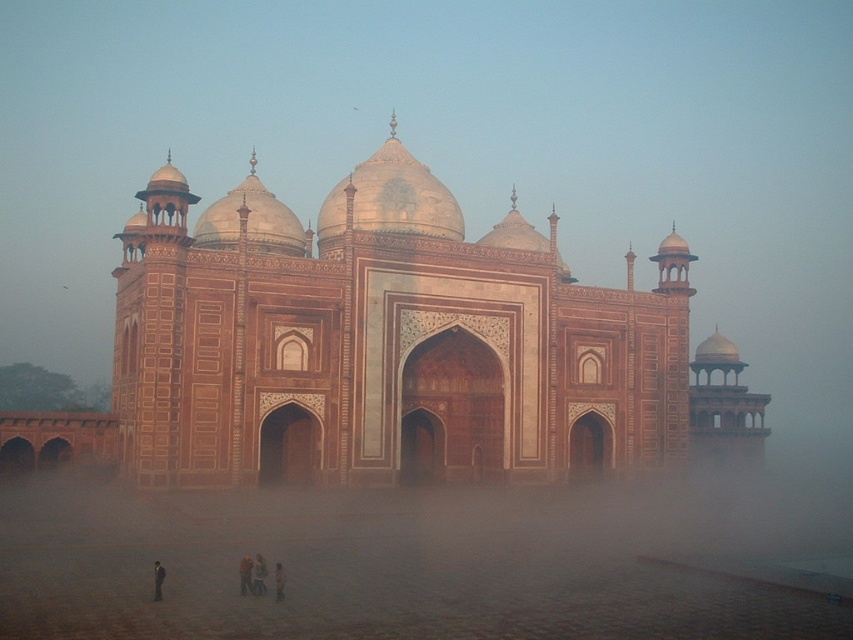
Question: Is marble palace at center further to camera compared to light brown fabric pants at lower center?

Choices:
 (A) no
 (B) yes

Answer: (B)

Question: Which object is positioned farthest from the light brown fabric pants at lower center?

Choices:
 (A) dark blue fabric at lower center
 (B) marble palace at center
 (C) light brown leather jacket at lower center

Answer: (B)

Question: Is marble palace at center wider than light brown leather jacket at lower center?

Choices:
 (A) no
 (B) yes

Answer: (B)

Question: Which object is farther from the camera taking this photo?

Choices:
 (A) light brown fabric pants at lower center
 (B) marble palace at center

Answer: (B)

Question: Which object is the farthest from the marble palace at center?

Choices:
 (A) light brown fabric pants at lower center
 (B) light brown leather jacket at lower center
 (C) dark blue fabric at lower center

Answer: (C)

Question: In this image, where is marble palace at center located relative to dark blue fabric at lower center?

Choices:
 (A) above
 (B) below

Answer: (A)